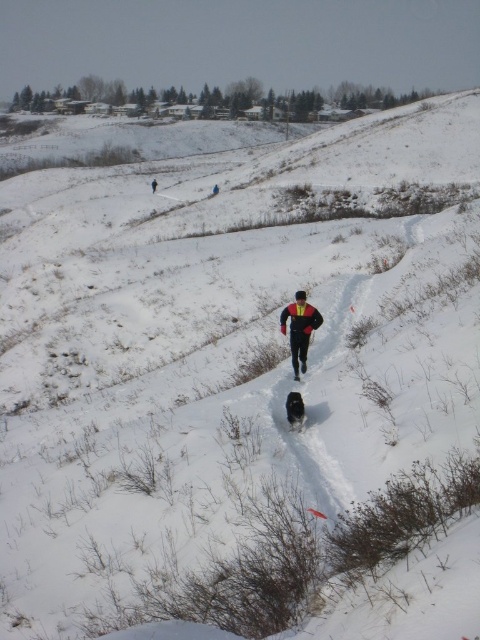
Identify the location of matte black jacket at center. The height and width of the screenshot is (640, 480). (300, 328).

Does matte black jacket at center have a larger size compared to black matte jacket at upper center?

No.

Is point (307, 305) less distant than point (155, 193)?

Yes, point (307, 305) is closer to viewer.

Find the location of `matte black jacket at center`. matte black jacket at center is located at coordinates click(300, 328).